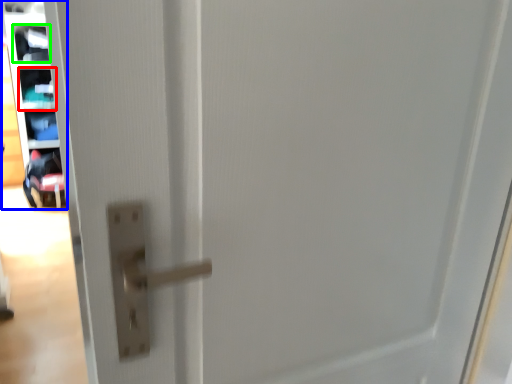
Question: Estimate the real-world distances between objects in this image. Which object is closer to shelf (highlighted by a red box), shelf (highlighted by a blue box) or shelf (highlighted by a green box)?

Choices:
 (A) shelf
 (B) shelf

Answer: (B)